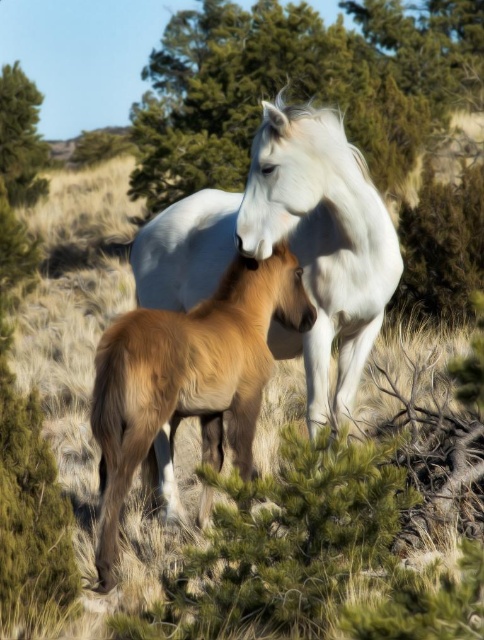
You are an artist sketching the scene and want to ensure proper proportions. Given the white glossy horse at center and the green leafy tree at upper left, which one should you draw smaller in your sketch?

The white glossy horse at center should be drawn smaller because it occupies less space than the green leafy tree at upper left in the scene.